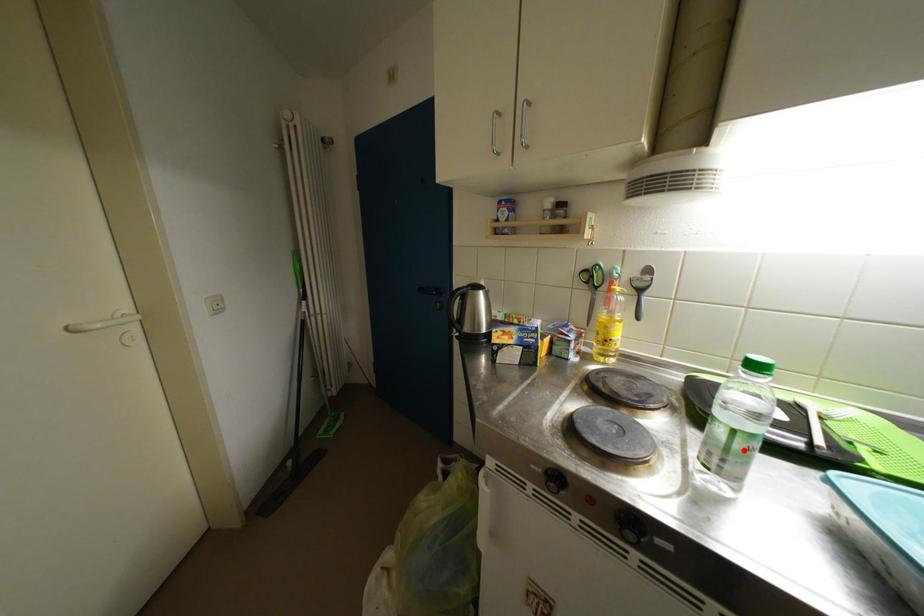
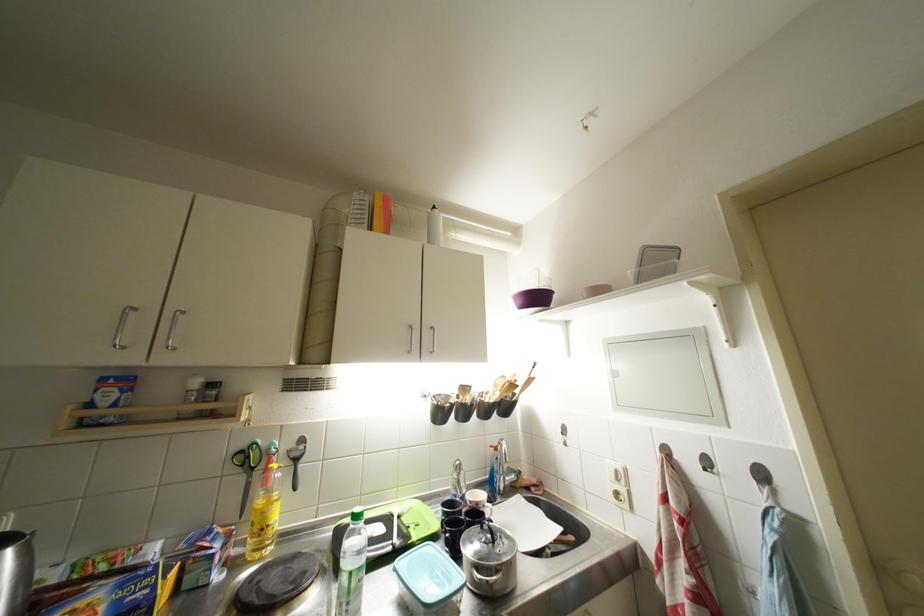
Where in the second image is the point corresponding to the highlighted location from the first image?

(359, 589)